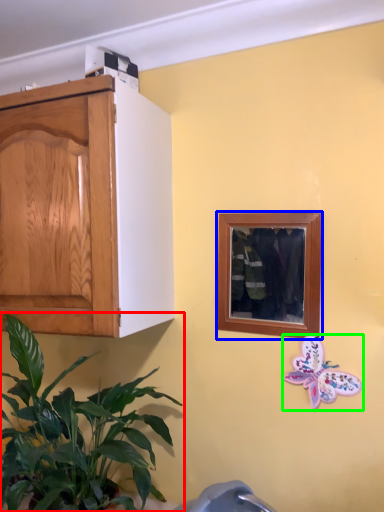
Question: Which object is positioned farthest from houseplant (highlighted by a red box)? Select from picture frame (highlighted by a blue box) and butterfly (highlighted by a green box).

Choices:
 (A) picture frame
 (B) butterfly

Answer: (B)